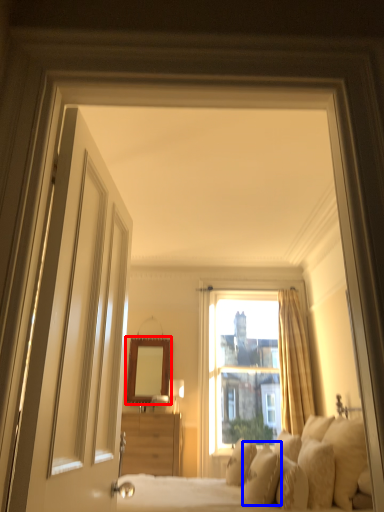
Question: Among these objects, which one is farthest to the camera, mirror (highlighted by a red box) or pillow (highlighted by a blue box)?

Choices:
 (A) mirror
 (B) pillow

Answer: (A)